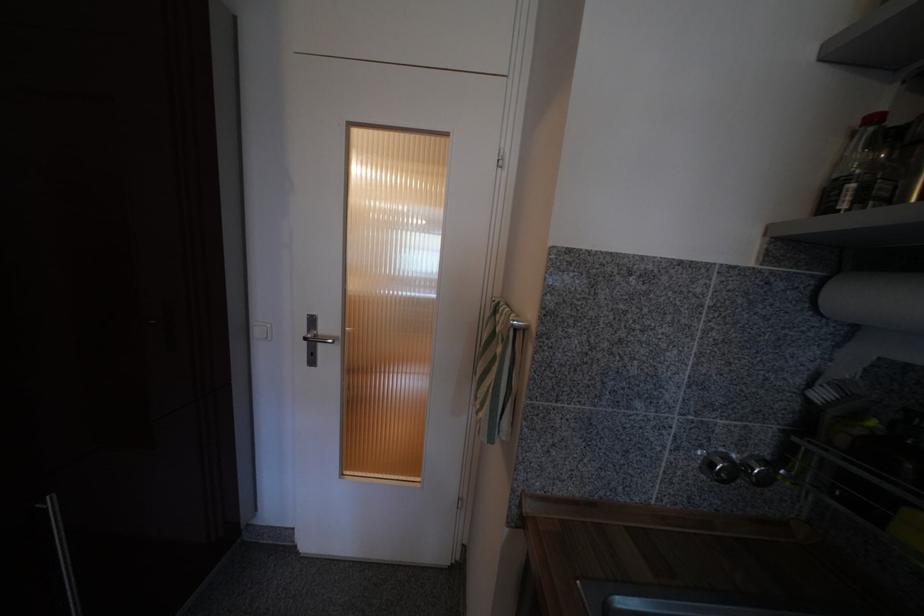
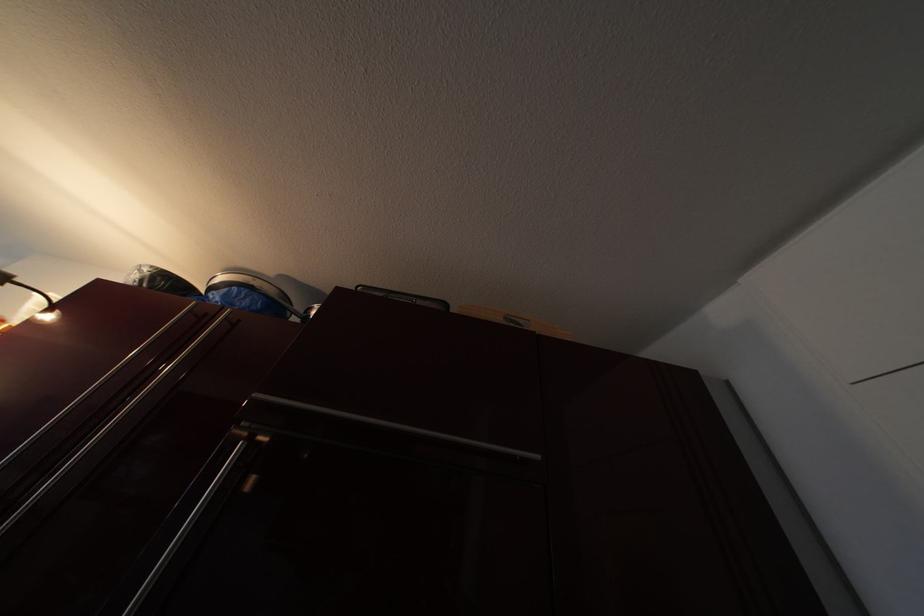
The first image is from the beginning of the video and the second image is from the end. How did the camera likely rotate when shooting the video?

The camera's rotation is toward left-up.